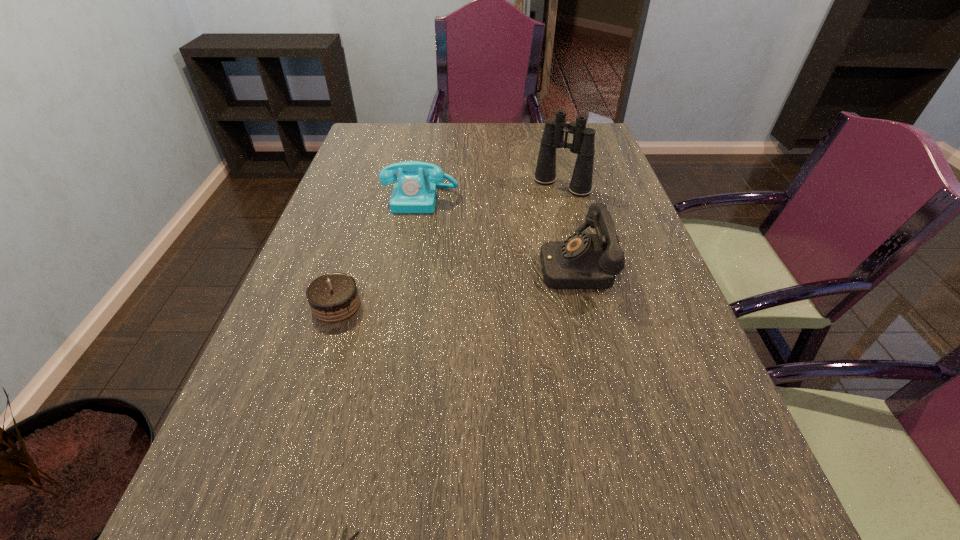
Where is `binoculars`? This screenshot has width=960, height=540. binoculars is located at coordinates (583, 139).

Locate an element on the screen. The width and height of the screenshot is (960, 540). the nearer telephone is located at coordinates (583, 261).

Identify the location of the fourth shortest object. (583, 261).

Find the location of a particular element. The height and width of the screenshot is (540, 960). the farther telephone is located at coordinates (415, 192).

What are the coordinates of `the third tallest object` in the screenshot? It's located at (415, 192).

You are a GUI agent. You are given a task and a screenshot of the screen. Output one action in this format:
    pyautogui.click(x=<x>, y=<y>)
    Task: Click on the chocolate cake
    
    Given the screenshot: What is the action you would take?
    pyautogui.click(x=333, y=297)

Where is `vacant space located on the front of the binoculars`? Image resolution: width=960 pixels, height=540 pixels. vacant space located on the front of the binoculars is located at coordinates (572, 224).

The height and width of the screenshot is (540, 960). Identify the location of vacant point located on the dial of the nearer telephone. (442, 265).

Identify the location of free space located 0.130m on the dial of the nearer telephone. (487, 265).

This screenshot has height=540, width=960. I want to click on vacant space situated 0.250m on the dial of the nearer telephone, so click(438, 265).